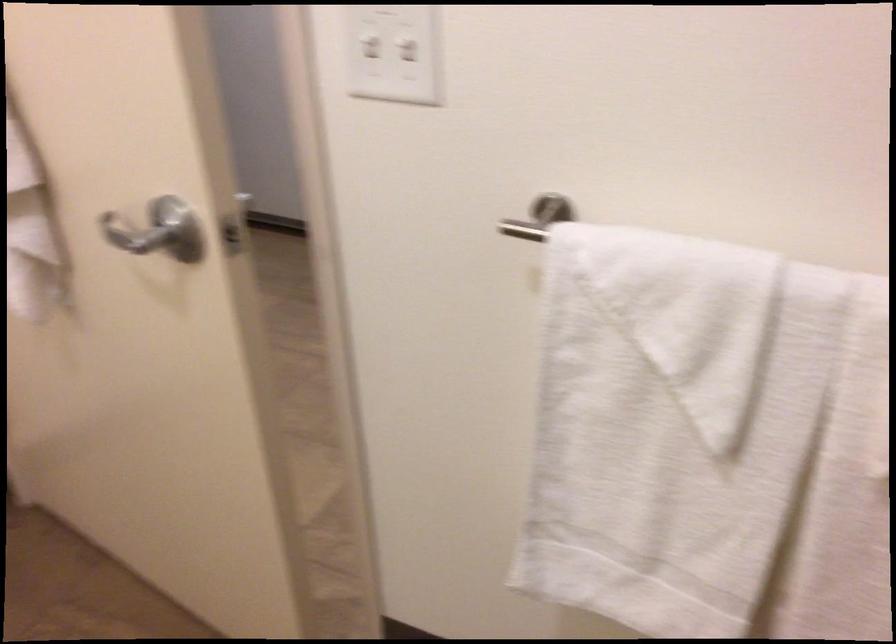
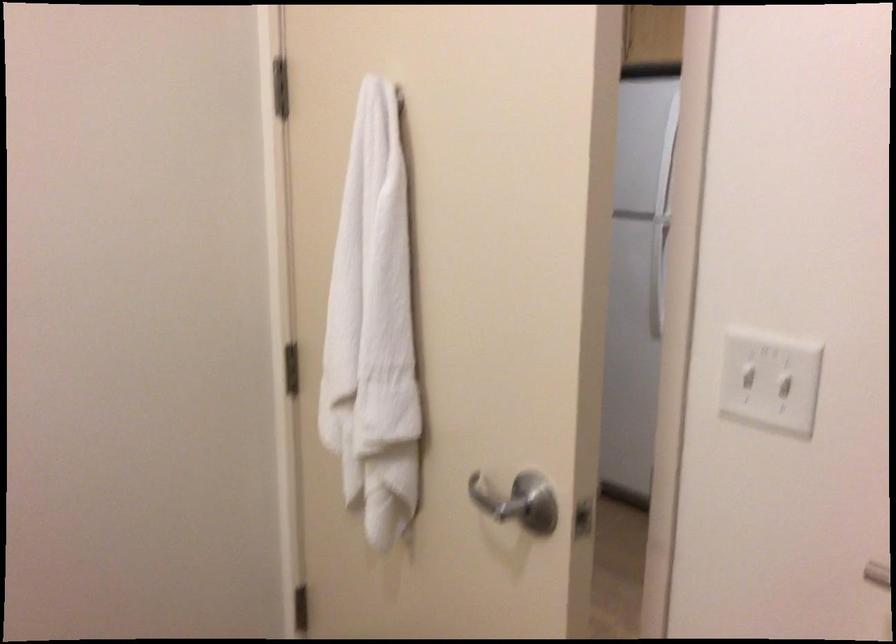
In a continuous first-person perspective shot, in which direction is the camera moving?

The cameraman walked toward left, backward.